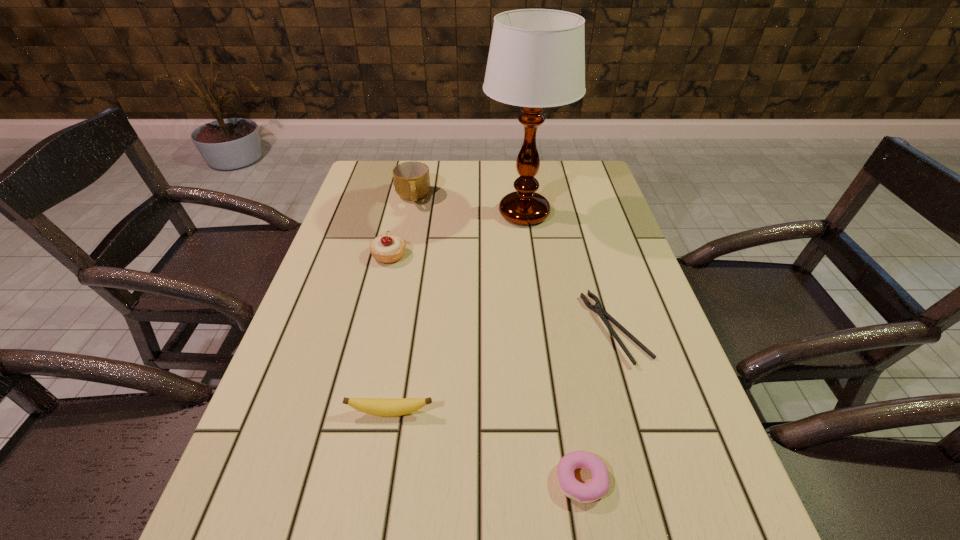
Locate an element on the screen. The image size is (960, 540). free spot between the tallest object and the second tallest object is located at coordinates (468, 205).

Locate an element on the screen. free space between the fourth shortest object and the fourth farthest object is located at coordinates (502, 292).

The width and height of the screenshot is (960, 540). Identify the location of unoccupied position between the fifth farthest object and the mug. (401, 305).

The width and height of the screenshot is (960, 540). What are the coordinates of `unoccupied position between the shortest object and the shorter pastry` in the screenshot? It's located at (598, 404).

The height and width of the screenshot is (540, 960). I want to click on free space between the tongs and the third farthest object, so (502, 292).

Locate an element on the screen. The image size is (960, 540). free space between the farther pastry and the mug is located at coordinates (401, 226).

Where is `free spot between the second nearest object and the mug`? Image resolution: width=960 pixels, height=540 pixels. free spot between the second nearest object and the mug is located at coordinates (401, 305).

This screenshot has width=960, height=540. Identify the location of vacant space in between the banana and the left pastry. (390, 334).

I want to click on unoccupied position between the nearer pastry and the left pastry, so click(x=486, y=368).

Locate an element on the screen. The image size is (960, 540). vacant area that lies between the tongs and the nearest object is located at coordinates (598, 404).